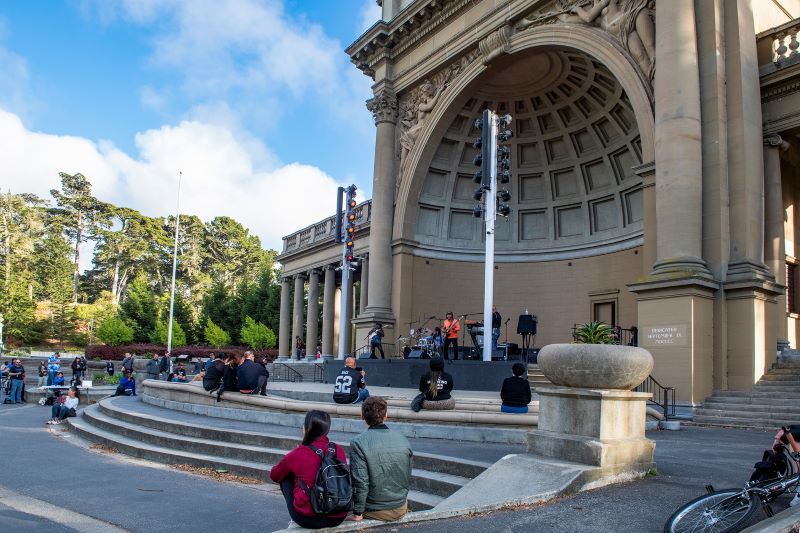
Locate an element on the screen. ledge is located at coordinates (284, 405).